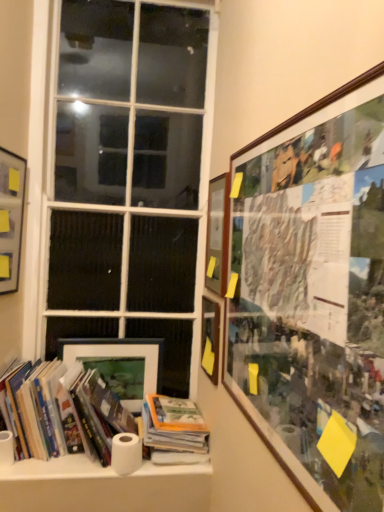
This screenshot has width=384, height=512. Describe the element at coordinates (128, 177) in the screenshot. I see `white glass window at center` at that location.

I want to click on wooden picture frame at upper right, the 4th picture frame when ordered from left to right, so click(217, 234).

Measure the distance between wooden framed collage at upper right, the 1th picture frame viewed from the right, and camera.

A distance of 23.66 inches exists between wooden framed collage at upper right, the 1th picture frame viewed from the right, and camera.

The height and width of the screenshot is (512, 384). I want to click on white matte paper towel at lower left, so click(56, 469).

Measure the distance between white matte paper towel at lower left and camera.

white matte paper towel at lower left and camera are 1.51 meters apart.

How much space does matte wooden picture frame at center, the third picture frame positioned from the right, occupy vertically?

The height of matte wooden picture frame at center, the third picture frame positioned from the right, is 11.85 inches.

How much space does hardcover books at lower left, positioned as the first book in left-to-right order, occupy horizontally?

hardcover books at lower left, positioned as the first book in left-to-right order, is 12.55 inches in width.

This screenshot has height=512, width=384. In order to click on white glass window at center in this screenshot , I will do `click(128, 177)`.

From a real-world perspective, who is located lower, wooden framed collage at upper right, which is the 5th picture frame in left-to-right order, or wooden picture frame at upper right, the 4th picture frame when ordered from left to right?

In real-world perspective, wooden framed collage at upper right, which is the 5th picture frame in left-to-right order, is lower.

Can we say wooden framed collage at upper right, the 1th picture frame viewed from the right, lies outside wooden picture frame at upper right, the 2th picture frame when ordered from right to left?

Yes.

From the picture: Is wooden framed collage at upper right, the 1th picture frame viewed from the right, taller than wooden picture frame at upper right, the 4th picture frame when ordered from left to right?

Indeed, wooden framed collage at upper right, the 1th picture frame viewed from the right, has a greater height compared to wooden picture frame at upper right, the 4th picture frame when ordered from left to right.

Which object is positioned more to the left, wooden framed collage at upper right, which is the 5th picture frame in left-to-right order, or wooden picture frame at upper right, the 2th picture frame when ordered from right to left?

Positioned to the left is wooden picture frame at upper right, the 2th picture frame when ordered from right to left.

Considering the points (171, 78) and (10, 462), which point is behind, point (171, 78) or point (10, 462)?

The point (171, 78) is more distant.

Is white glass window at center next to white matte paper towel at lower left and touching it?

No, white glass window at center is not touching white matte paper towel at lower left.

Between white glass window at center and white matte paper towel at lower left, which one has larger size?

white glass window at center is bigger.

Considering their positions, is white glass window at center located in front of or behind white matte paper towel at lower left?

In the image, white glass window at center appears behind white matte paper towel at lower left.

Looking at their sizes, would you say white matte paper towel at lower left is wider or thinner than hardcover books at lower left, positioned as the first book in left-to-right order?

Clearly, white matte paper towel at lower left has less width compared to hardcover books at lower left, positioned as the first book in left-to-right order.

How distant is white matte paper towel at lower left from hardcover books at lower left, positioned as the first book in left-to-right order?

white matte paper towel at lower left and hardcover books at lower left, positioned as the first book in left-to-right order, are 12.93 inches apart from each other.

In the image, is white matte paper towel at lower left on the left side or the right side of hardcover books at lower left, positioned as the first book in left-to-right order?

Based on their positions, white matte paper towel at lower left is located to the left of hardcover books at lower left, positioned as the first book in left-to-right order.

Between white matte paper towel at lower left and hardcover books at lower left, the 2th book in the right-to-left sequence, which one has less height?

Standing shorter between the two is white matte paper towel at lower left.

Which object is closer to the camera, hardcover books at lower left, positioned as the first book in left-to-right order, or wooden picture frame at upper right, the 4th picture frame when ordered from left to right?

hardcover books at lower left, positioned as the first book in left-to-right order, is closer to the camera.

In terms of size, does hardcover books at lower left, positioned as the first book in left-to-right order, appear bigger or smaller than wooden picture frame at upper right, the 2th picture frame when ordered from right to left?

hardcover books at lower left, positioned as the first book in left-to-right order, is bigger than wooden picture frame at upper right, the 2th picture frame when ordered from right to left.

Does hardcover books at lower left, the 2th book in the right-to-left sequence, have a lesser width compared to wooden picture frame at upper right, the 4th picture frame when ordered from left to right?

No, hardcover books at lower left, the 2th book in the right-to-left sequence, is not thinner than wooden picture frame at upper right, the 4th picture frame when ordered from left to right.

Who is taller, white glass window at center or white matte paper towel at lower left?

Standing taller between the two is white glass window at center.

From the image's perspective, is white glass window at center above white matte paper towel at lower left?

Correct, white glass window at center appears higher than white matte paper towel at lower left in the image.

Is white glass window at center facing away from white matte paper towel at lower left?

No.

Can you tell me how much white glass window at center and white matte paper towel at lower left differ in facing direction?

0.47 degrees separate the facing orientations of white glass window at center and white matte paper towel at lower left.

Is white matte paper towel at lower left shorter than white matte toilet paper at lower center?

Correct, white matte paper towel at lower left is not as tall as white matte toilet paper at lower center.

Would you say white matte paper towel at lower left is inside or outside white matte toilet paper at lower center?

white matte paper towel at lower left is not enclosed by white matte toilet paper at lower center.

How different are the orientations of wooden picture frame at upper right, the 2th picture frame when ordered from right to left, and matte black picture frame at lower left, placed as the 4th picture frame when sorted from right to left, in degrees?

They differ by 89.9 degrees in their facing directions.

Is wooden picture frame at upper right, the 2th picture frame when ordered from right to left, closer to the viewer compared to matte black picture frame at lower left, placed as the 4th picture frame when sorted from right to left?

Yes, it is in front of matte black picture frame at lower left, placed as the 4th picture frame when sorted from right to left.

Which of these two, wooden picture frame at upper right, the 4th picture frame when ordered from left to right, or matte black picture frame at lower left, the second picture frame viewed from the left, is wider?

With larger width is wooden picture frame at upper right, the 4th picture frame when ordered from left to right.

Could you tell me if wooden picture frame at upper right, the 4th picture frame when ordered from left to right, is facing matte black picture frame at lower left, the second picture frame viewed from the left?

No, wooden picture frame at upper right, the 4th picture frame when ordered from left to right, is not turned towards matte black picture frame at lower left, the second picture frame viewed from the left.

There is a wooden picture frame at upper right, the 4th picture frame when ordered from left to right. Where is `the 1st picture frame below it (from a real-world perspective)`? the 1st picture frame below it (from a real-world perspective) is located at coordinates (314, 294).

Locate an element on the screen. Image resolution: width=384 pixels, height=512 pixels. window above the white matte paper towel at lower left (from the image's perspective) is located at coordinates (128, 177).

Consider the image. Considering their positions, is matte black picture frame at lower left, the second picture frame viewed from the left, positioned closer to wooden picture frame at upper right, the 2th picture frame when ordered from right to left, than hardcover books at lower left, positioned as the first book in left-to-right order?

Based on the image, matte black picture frame at lower left, the second picture frame viewed from the left, appears to be nearer to wooden picture frame at upper right, the 2th picture frame when ordered from right to left.

Considering their positions, is matte wooden picture frame at center, the third picture frame positioned from the right, positioned further to white matte paper towel at lower left than hardcover book at center, marked as the 2th book in a left-to-right arrangement?

matte wooden picture frame at center, the third picture frame positioned from the right.

Looking at this image, which object lies further to the anchor point white matte paper towel at lower left, wooden picture frame at upper right, the 2th picture frame when ordered from right to left, or wooden framed collage at upper right, the 1th picture frame viewed from the right?

Among the two, wooden framed collage at upper right, the 1th picture frame viewed from the right, is located further to white matte paper towel at lower left.

Looking at this image, considering their positions, is matte black picture frame at upper left, the 5th picture frame when ordered from right to left, positioned further to matte wooden picture frame at center, arranged as the 3th picture frame when viewed from the left, than hardcover book at center, marked as the 2th book in a left-to-right arrangement?

matte black picture frame at upper left, the 5th picture frame when ordered from right to left.

Based on their spatial positions, is white glass window at center or white matte paper towel at lower left closer to hardcover book at center, marked as the 2th book in a left-to-right arrangement?

The object closer to hardcover book at center, marked as the 2th book in a left-to-right arrangement, is white matte paper towel at lower left.

Which object lies further to the anchor point matte black picture frame at lower left, the second picture frame viewed from the left, hardcover book at center, the 1th book when ordered from right to left, or matte wooden picture frame at center, arranged as the 3th picture frame when viewed from the left?

matte wooden picture frame at center, arranged as the 3th picture frame when viewed from the left, is further to matte black picture frame at lower left, the second picture frame viewed from the left.

Based on their spatial positions, is white matte paper towel at lower left or white matte paper towel at lower left closer to matte black picture frame at lower left, the second picture frame viewed from the left?

The object closer to matte black picture frame at lower left, the second picture frame viewed from the left, is white matte paper towel at lower left.

Considering their positions, is wooden picture frame at upper right, the 2th picture frame when ordered from right to left, positioned further to white glass window at center than hardcover book at center, marked as the 2th book in a left-to-right arrangement?

hardcover book at center, marked as the 2th book in a left-to-right arrangement, lies further to white glass window at center than the other object.

Locate an element on the screen. toilet paper between white matte paper towel at lower left and hardcover book at center, marked as the 2th book in a left-to-right arrangement, in the horizontal direction is located at coordinates (126, 453).

At what (x,y) coordinates should I click in order to perform the action: click on window located between matte black picture frame at upper left, the first picture frame positioned from the left, and wooden picture frame at upper right, the 4th picture frame when ordered from left to right, in the left-right direction. Please return your answer as a coordinate pair (x, y). This screenshot has width=384, height=512. Looking at the image, I should click on (128, 177).

At what (x,y) coordinates should I click in order to perform the action: click on paper towel positioned between hardcover books at lower left, positioned as the first book in left-to-right order, and matte black picture frame at lower left, placed as the 4th picture frame when sorted from right to left, from near to far. Please return your answer as a coordinate pair (x, y). Looking at the image, I should click on (6, 448).

This screenshot has height=512, width=384. I want to click on picture frame between matte black picture frame at upper left, the 5th picture frame when ordered from right to left, and matte wooden picture frame at center, arranged as the 3th picture frame when viewed from the left, in the horizontal direction, so pos(119,365).